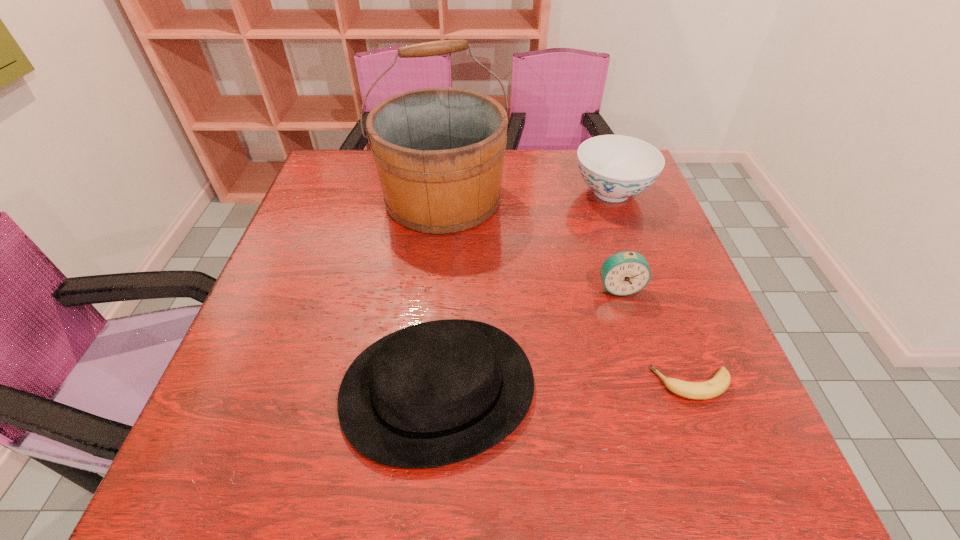
Where is `vacant position located at the stem of the banana`? This screenshot has height=540, width=960. vacant position located at the stem of the banana is located at coordinates (516, 384).

The height and width of the screenshot is (540, 960). I want to click on blank space located at the stem of the banana, so [455, 384].

Find the location of a particular element. The image size is (960, 540). bucket that is at the far edge is located at coordinates (439, 152).

Find the location of `chinaware that is at the far edge`. chinaware that is at the far edge is located at coordinates (616, 167).

I want to click on object at the near edge, so click(x=436, y=393).

Locate an element on the screen. This screenshot has width=960, height=540. chinaware that is at the right edge is located at coordinates (616, 167).

At what (x,y) coordinates should I click in order to perform the action: click on alarm clock located in the right edge section of the desktop. Please return your answer as a coordinate pair (x, y). The width and height of the screenshot is (960, 540). Looking at the image, I should click on (624, 273).

Locate an element on the screen. banana that is at the right edge is located at coordinates (714, 387).

In order to click on object at the far right corner in this screenshot , I will do [616, 167].

The height and width of the screenshot is (540, 960). I want to click on vacant space at the far edge, so click(506, 184).